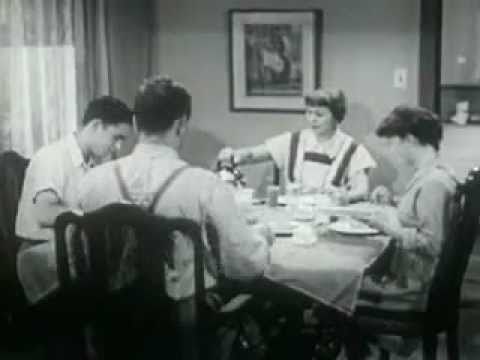
Locate an element on the screen. Image resolution: width=480 pixels, height=360 pixels. wall is located at coordinates 359,42.